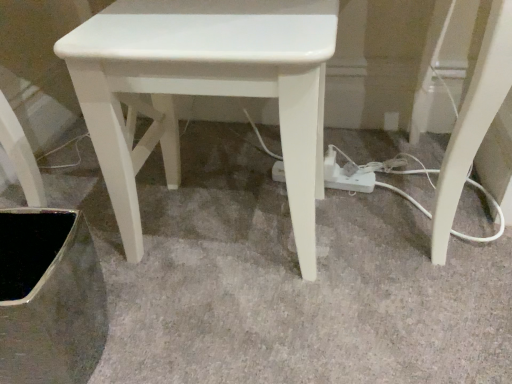
Question: From a real-world perspective, relative to white matte stool at center, is white plastic extension cord at lower center vertically above or below?

Choices:
 (A) above
 (B) below

Answer: (B)

Question: Is white plastic extension cord at lower center inside the boundaries of white matte stool at center, or outside?

Choices:
 (A) inside
 (B) outside

Answer: (B)

Question: In the image, is white plastic extension cord at lower center positioned in front of or behind white matte stool at center?

Choices:
 (A) front
 (B) behind

Answer: (B)

Question: In terms of height, does white matte stool at center look taller or shorter compared to white plastic extension cord at lower center?

Choices:
 (A) tall
 (B) short

Answer: (A)

Question: Is white matte stool at center inside or outside of white plastic extension cord at lower center?

Choices:
 (A) outside
 (B) inside

Answer: (A)

Question: In the image, is white matte stool at center positioned in front of or behind white plastic extension cord at lower center?

Choices:
 (A) front
 (B) behind

Answer: (A)

Question: Looking at their shapes, would you say white matte stool at center is wider or thinner than white plastic extension cord at lower center?

Choices:
 (A) wide
 (B) thin

Answer: (A)